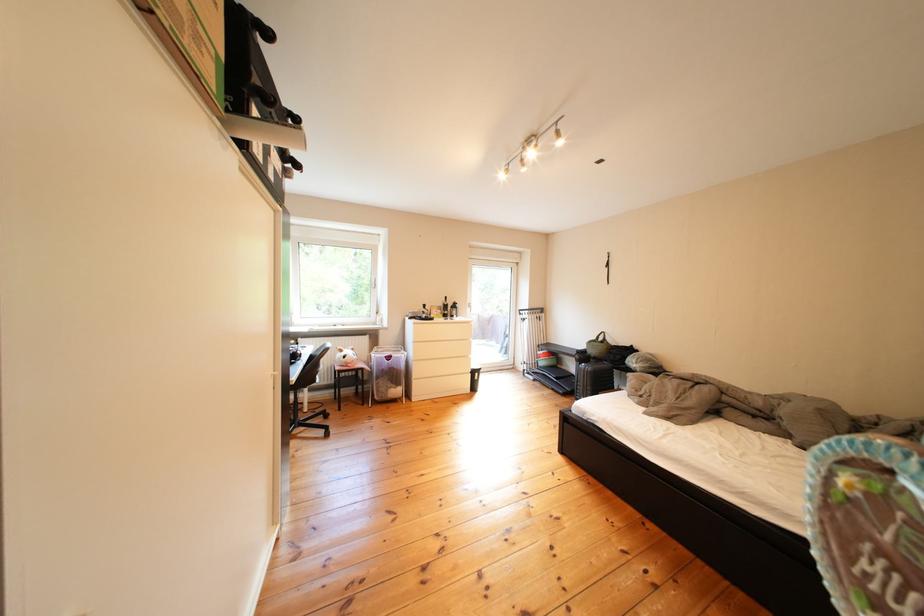
This screenshot has height=616, width=924. Identify the location of black suitcase. (592, 378).